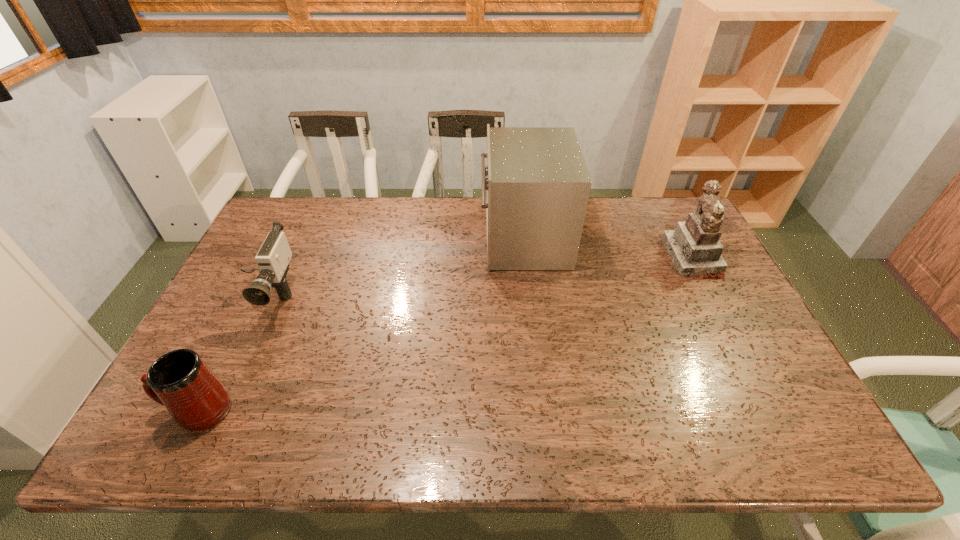
In order to click on free space that satisfies the following two spatial constraints: 1. on the front panel of the third object from left to right; 2. on the recording direction of the camcorder in this screenshot , I will do `click(531, 298)`.

You are a GUI agent. You are given a task and a screenshot of the screen. Output one action in this format:
    pyautogui.click(x=<x>, y=<y>)
    Task: Click on the vacant area that satisfies the following two spatial constraints: 1. on the front panel of the toaster oven; 2. on the recording direction of the camcorder
    The height and width of the screenshot is (540, 960).
    Given the screenshot: What is the action you would take?
    pyautogui.click(x=531, y=298)

The width and height of the screenshot is (960, 540). What are the coordinates of `free space that satisfies the following two spatial constraints: 1. on the front-facing side of the second tallest object; 2. on the recording direction of the camcorder` in the screenshot? It's located at (712, 298).

In order to click on vacant point that satisfies the following two spatial constraints: 1. on the front-facing side of the rightmost object; 2. on the recording direction of the camcorder in this screenshot , I will do point(712,298).